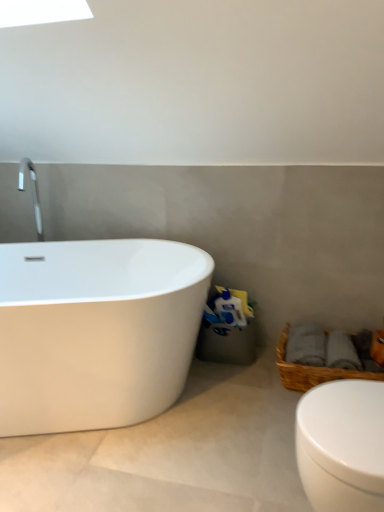
I want to click on white glossy toilet at lower right, so click(342, 445).

Does point (290, 380) appear closer or farther from the camera than point (162, 313)?

Point (290, 380) is farther from the camera than point (162, 313).

The width and height of the screenshot is (384, 512). I want to click on basket below the white glossy bathtub at left (from a real-world perspective), so click(x=312, y=370).

Is woven brown basket at lower right touching white glossy bathtub at left?

woven brown basket at lower right is not next to white glossy bathtub at left, and they're not touching.

Who is more distant, white glossy bathtub at left or woven brown basket at lower right?

woven brown basket at lower right is further away from the camera.

Which of these two, white glossy bathtub at left or woven brown basket at lower right, is smaller?

With smaller size is woven brown basket at lower right.

From the image's perspective, is white glossy bathtub at left under woven brown basket at lower right?

Actually, white glossy bathtub at left appears above woven brown basket at lower right in the image.

Considering the sizes of objects white glossy toilet at lower right and woven brown basket at lower right in the image provided, who is shorter, white glossy toilet at lower right or woven brown basket at lower right?

Standing shorter between the two is woven brown basket at lower right.

Can you see white glossy toilet at lower right touching woven brown basket at lower right?

No, white glossy toilet at lower right is not making contact with woven brown basket at lower right.

Is white glossy toilet at lower right positioned with its back to woven brown basket at lower right?

No, white glossy toilet at lower right is not facing the opposite direction of woven brown basket at lower right.

Is woven brown basket at lower right far away from white glossy toilet at lower right?

No, there isn't a large distance between woven brown basket at lower right and white glossy toilet at lower right.

Does woven brown basket at lower right have a greater height compared to white glossy toilet at lower right?

No.

Which object is closer to the camera, woven brown basket at lower right or white glossy toilet at lower right?

Positioned in front is white glossy toilet at lower right.

Which of these two, white glossy bathtub at left or white glossy toilet at lower right, is bigger?

white glossy bathtub at left.

Looking at their sizes, would you say white glossy bathtub at left is wider or thinner than white glossy toilet at lower right?

In the image, white glossy bathtub at left appears to be wider than white glossy toilet at lower right.

From the image's perspective, between white glossy bathtub at left and white glossy toilet at lower right, which one is located above?

white glossy bathtub at left is shown above in the image.

Considering the points (103, 395) and (376, 485), which point is in front, point (103, 395) or point (376, 485)?

Positioned in front is point (376, 485).

Is point (310, 485) less distant than point (75, 325)?

That is True.

From a real-world perspective, between white glossy toilet at lower right and white glossy bathtub at left, who is vertically higher?

white glossy bathtub at left, from a real-world perspective.

Is white glossy toilet at lower right facing away from white glossy bathtub at left?

No, white glossy bathtub at left is not at the back of white glossy toilet at lower right.

Identify the location of bathtub on the left of woven brown basket at lower right. (96, 331).

The image size is (384, 512). In the image, there is a white glossy bathtub at left. In order to click on basket below it (from the image's perspective) in this screenshot , I will do `click(312, 370)`.

Estimate the real-world distances between objects in this image. Which object is further from woven brown basket at lower right, white glossy bathtub at left or white glossy toilet at lower right?

The object further to woven brown basket at lower right is white glossy bathtub at left.

Which object lies further to the anchor point white glossy toilet at lower right, white glossy bathtub at left or woven brown basket at lower right?

Based on the image, white glossy bathtub at left appears to be further to white glossy toilet at lower right.

Which object lies further to the anchor point white glossy bathtub at left, white glossy toilet at lower right or woven brown basket at lower right?

white glossy toilet at lower right.

Based on their spatial positions, is woven brown basket at lower right or white glossy toilet at lower right closer to white glossy bathtub at left?

Based on the image, woven brown basket at lower right appears to be nearer to white glossy bathtub at left.

Looking at the image, which one is located closer to woven brown basket at lower right, white glossy toilet at lower right or white glossy bathtub at left?

white glossy toilet at lower right is closer to woven brown basket at lower right.

Considering their positions, is woven brown basket at lower right positioned closer to white glossy toilet at lower right than white glossy bathtub at left?

woven brown basket at lower right is closer to white glossy toilet at lower right.

The height and width of the screenshot is (512, 384). I want to click on toilet between white glossy bathtub at left and woven brown basket at lower right, so click(x=342, y=445).